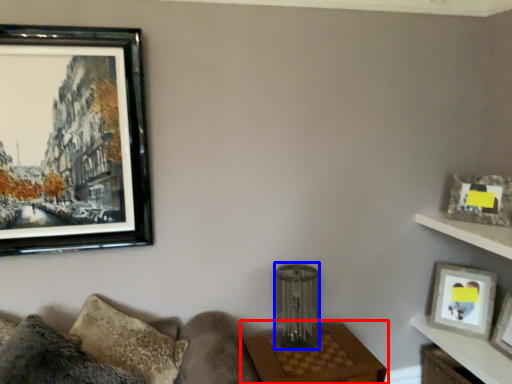
Question: Which object is further to the camera taking this photo, table (highlighted by a red box) or lamp (highlighted by a blue box)?

Choices:
 (A) table
 (B) lamp

Answer: (B)